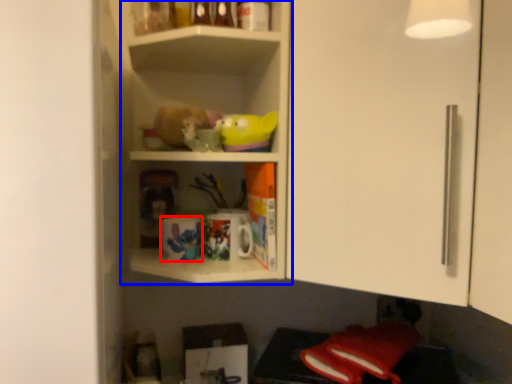
Question: Which point is closer to the camera, mug (highlighted by a red box) or shelf (highlighted by a blue box)?

Choices:
 (A) mug
 (B) shelf

Answer: (B)